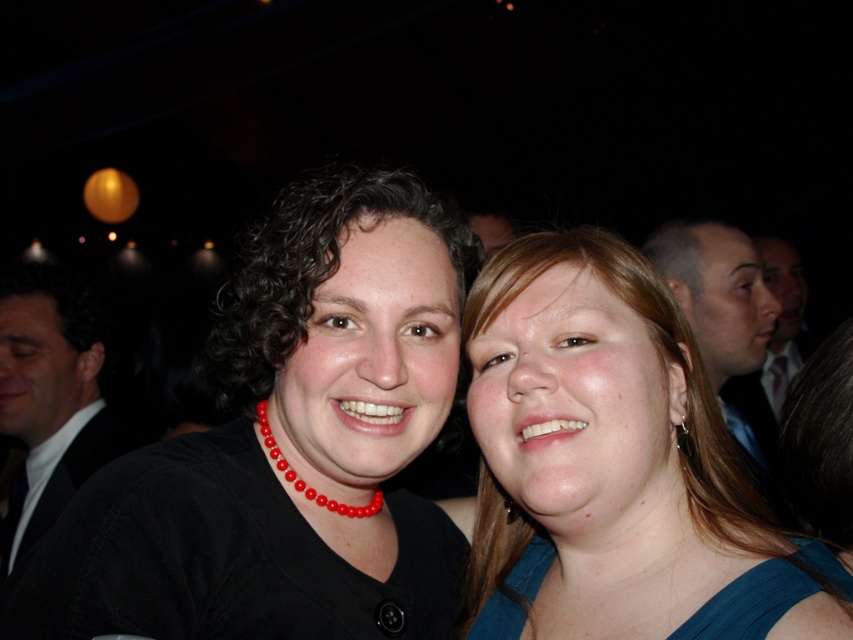
Question: Can you confirm if blue fabric at center is wider than red beaded necklace at center?

Choices:
 (A) yes
 (B) no

Answer: (A)

Question: Does shiny black suit at right appear on the right side of blue fabric dress at lower right?

Choices:
 (A) no
 (B) yes

Answer: (B)

Question: Which of the following is the closest to the observer?

Choices:
 (A) black matte necklace at upper center
 (B) shiny black suit at right
 (C) blue fabric at center

Answer: (A)

Question: Which object is positioned closest to the black matte necklace at upper center?

Choices:
 (A) blue fabric dress at lower right
 (B) red beaded necklace at center
 (C) black suit at left

Answer: (B)

Question: Where is shiny black suit at right located in relation to red beaded necklace at center in the image?

Choices:
 (A) above
 (B) below

Answer: (A)

Question: Estimate the real-world distances between objects in this image. Which object is closer to the black matte necklace at upper center?

Choices:
 (A) red beaded necklace at center
 (B) blue fabric dress at lower right
 (C) shiny black suit at right

Answer: (A)